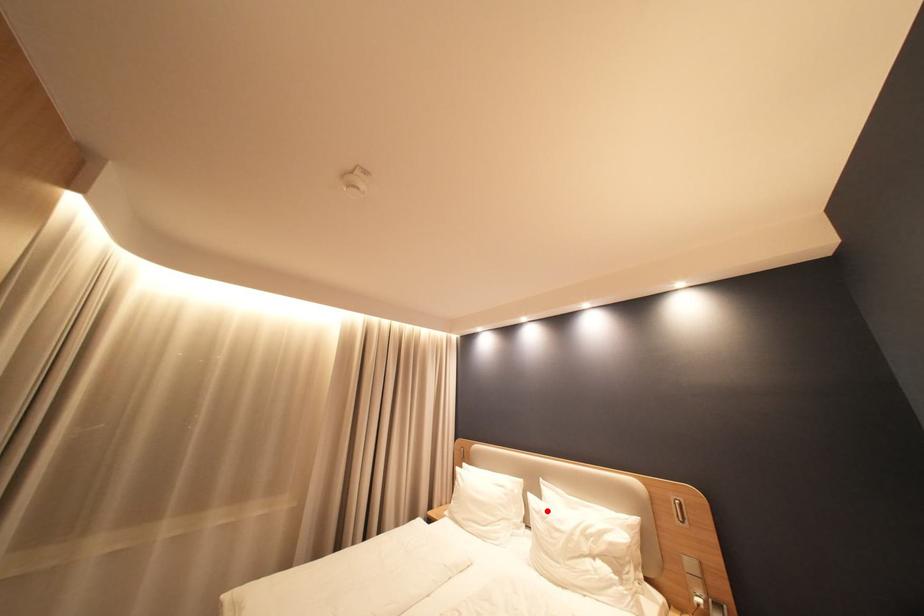
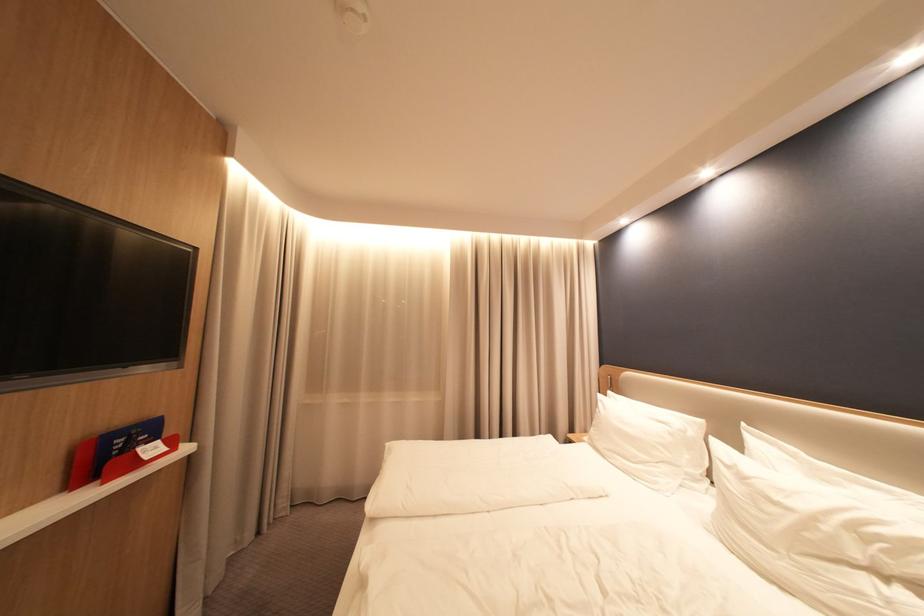
Where in the second image is the point corresponding to the highlighted location from the first image?

(737, 464)